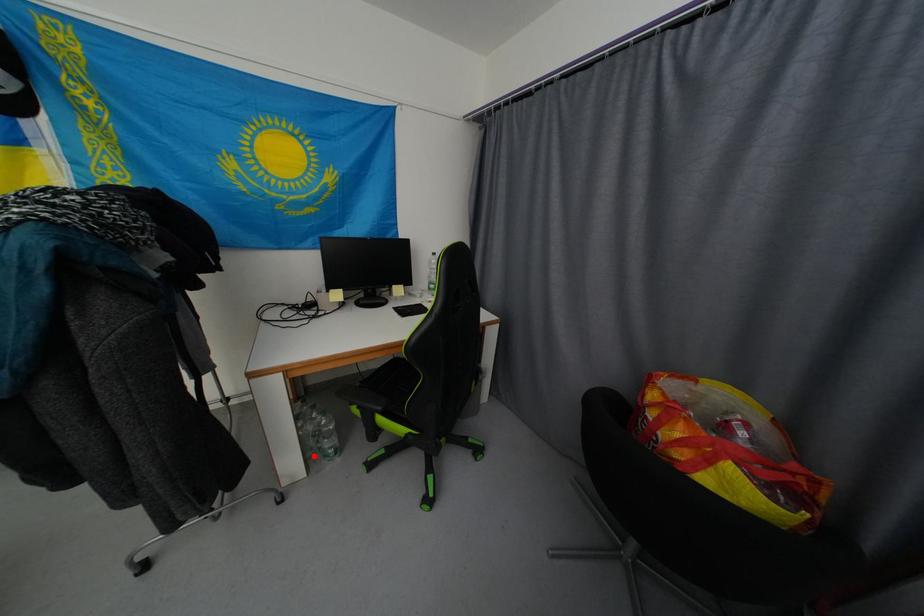
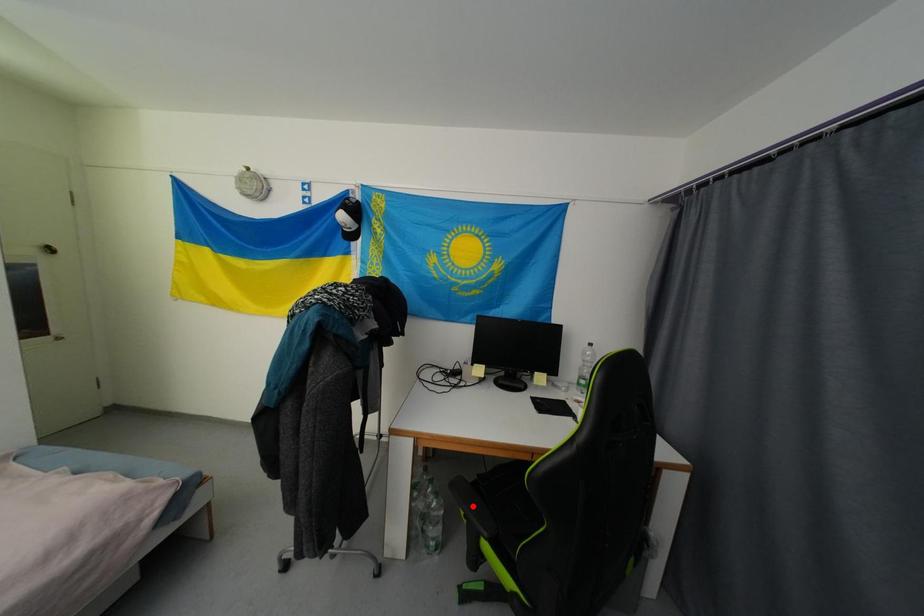
I am providing you with two images of the same scene from different viewpoints. A red point is marked on the first image and another point is marked on the second image. Is the marked point in image1 the same physical position as the marked point in image2?

No